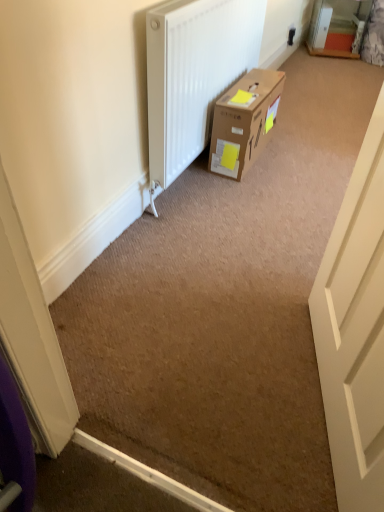
The width and height of the screenshot is (384, 512). I want to click on vacant area on the back side of white matte door at right, so click(x=253, y=271).